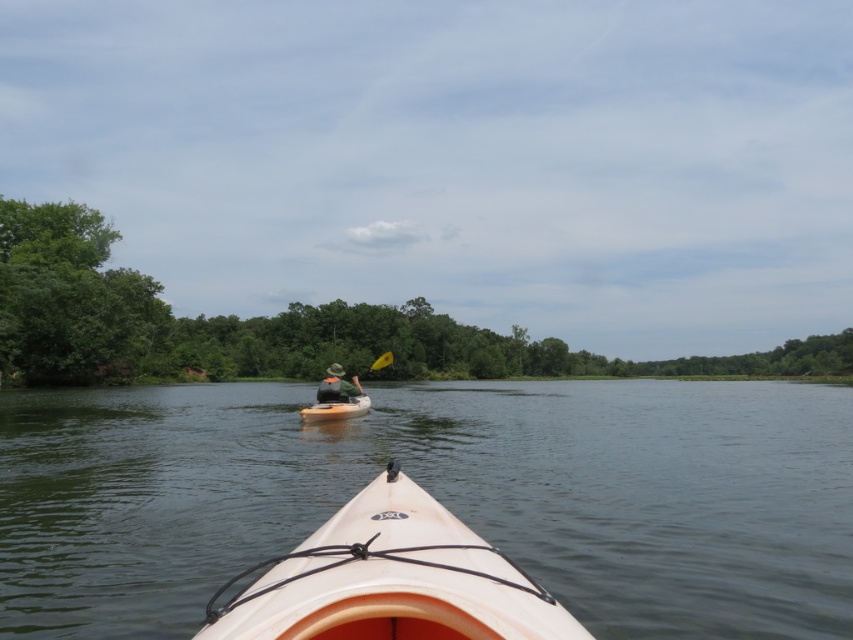
You are in a white kayak and see two points on the water ahead of you. The first point is at coordinates point (129, 545) and the second is at point (363, 598). Which point is closer to your kayak?

Point (363, 598) is closer to your kayak because it is in front of point (129, 545), which is behind it.

You are in a white kayak and see two points on the water ahead. The first point is at coordinates point (77, 241) and the second is at point (357, 394). Which point is closer to you?

Point (357, 394) is closer to you because point (77, 241) is behind it.

You are in a kayak and notice the green leafy trees at left and the yellow foam paddle at center. Which object is taller?

The green leafy trees at left are taller than the yellow foam paddle at center.